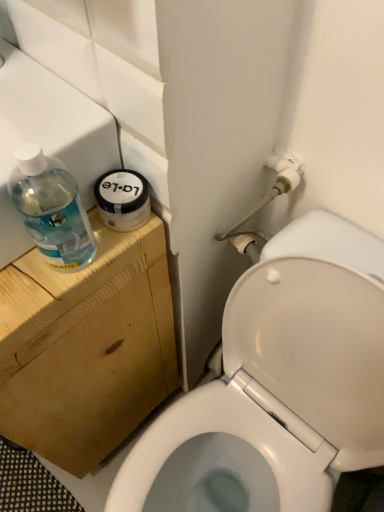
Question: Should I look upward or downward to see transparent plastic sink at upper left, which appears as the 2th sink when viewed from the front?

Choices:
 (A) up
 (B) down

Answer: (B)

Question: Could you tell me if transparent plastic bottle at left is facing transparent plastic sink at upper left, the 2th sink in the back-to-front sequence?

Choices:
 (A) no
 (B) yes

Answer: (A)

Question: From the image's perspective, is transparent plastic bottle at left above transparent plastic sink at upper left, positioned as the first sink in front-to-back order?

Choices:
 (A) no
 (B) yes

Answer: (A)

Question: Would you say transparent plastic bottle at left is a long distance from transparent plastic sink at upper left, the 2th sink in the back-to-front sequence?

Choices:
 (A) no
 (B) yes

Answer: (A)

Question: Considering the relative sizes of transparent plastic bottle at left and transparent plastic sink at upper left, positioned as the first sink in front-to-back order, in the image provided, is transparent plastic bottle at left bigger than transparent plastic sink at upper left, positioned as the first sink in front-to-back order,?

Choices:
 (A) no
 (B) yes

Answer: (A)

Question: Is the depth of transparent plastic bottle at left greater than that of transparent plastic sink at upper left, positioned as the first sink in front-to-back order?

Choices:
 (A) no
 (B) yes

Answer: (A)

Question: From a real-world perspective, is transparent plastic bottle at left under transparent plastic sink at upper left, positioned as the first sink in front-to-back order?

Choices:
 (A) yes
 (B) no

Answer: (B)

Question: From the image's perspective, is white glossy toilet at lower right located beneath transparent plastic sink at upper left, which appears as the 2th sink when viewed from the front?

Choices:
 (A) yes
 (B) no

Answer: (A)

Question: Is white glossy toilet at lower right facing away from transparent plastic sink at upper left, which appears as the 2th sink when viewed from the front?

Choices:
 (A) no
 (B) yes

Answer: (A)

Question: Is white glossy toilet at lower right bigger than transparent plastic sink at upper left, which appears as the 2th sink when viewed from the front?

Choices:
 (A) yes
 (B) no

Answer: (B)

Question: Does white glossy toilet at lower right appear on the right side of transparent plastic sink at upper left, which appears as the 2th sink when viewed from the front?

Choices:
 (A) no
 (B) yes

Answer: (B)

Question: From a real-world perspective, is white glossy toilet at lower right positioned over transparent plastic sink at upper left, the first sink viewed from the back, based on gravity?

Choices:
 (A) yes
 (B) no

Answer: (B)

Question: Considering the relative sizes of white glossy toilet at lower right and transparent plastic sink at upper left, which appears as the 2th sink when viewed from the front, in the image provided, is white glossy toilet at lower right shorter than transparent plastic sink at upper left, which appears as the 2th sink when viewed from the front,?

Choices:
 (A) no
 (B) yes

Answer: (B)

Question: Considering the relative sizes of transparent plastic sink at upper left, the 2th sink in the back-to-front sequence, and transparent plastic sink at upper left, the first sink viewed from the back, in the image provided, is transparent plastic sink at upper left, the 2th sink in the back-to-front sequence, shorter than transparent plastic sink at upper left, the first sink viewed from the back,?

Choices:
 (A) yes
 (B) no

Answer: (A)